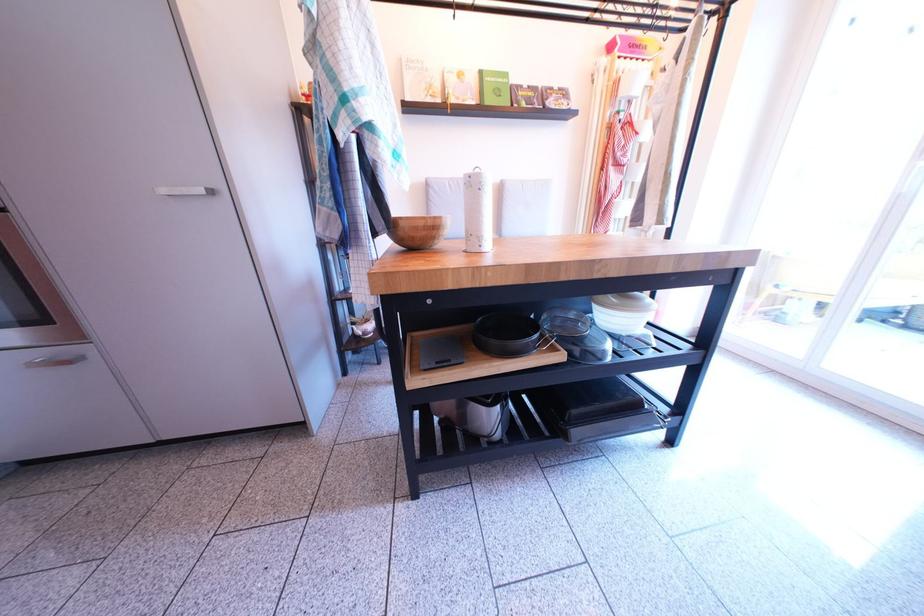
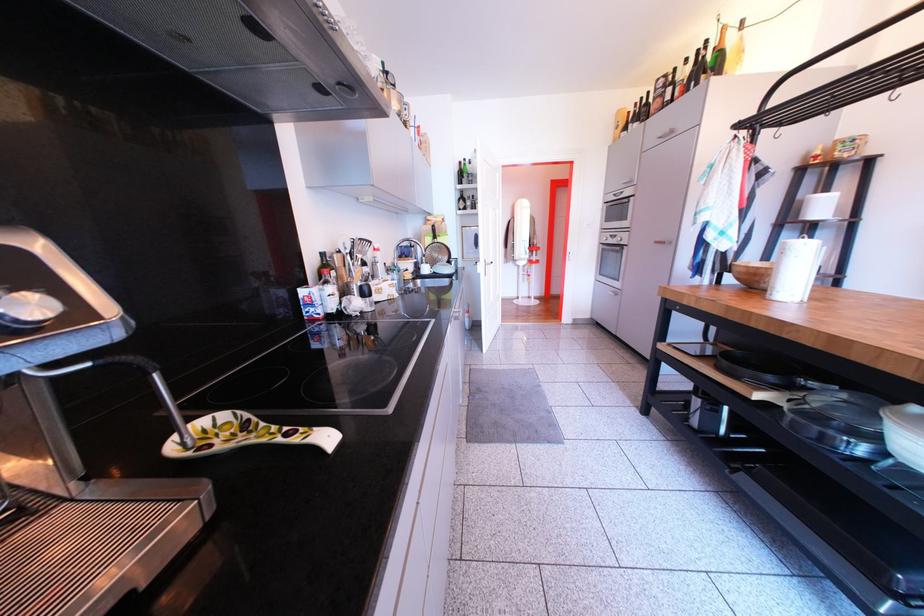
In the second image, find the point that corresponds to point (441, 229) in the first image.

(762, 277)